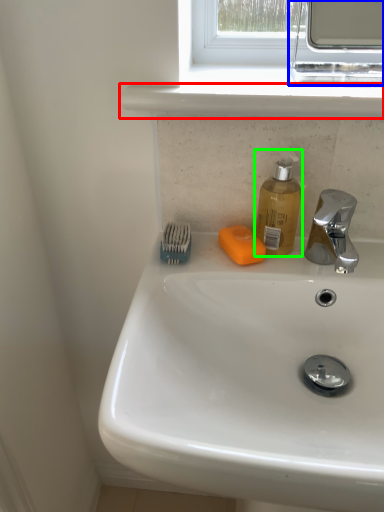
Question: Which object is positioned closest to window sill (highlighted by a red box)? Select from medicine cabinet (highlighted by a blue box) and soap dispenser (highlighted by a green box).

Choices:
 (A) medicine cabinet
 (B) soap dispenser

Answer: (B)